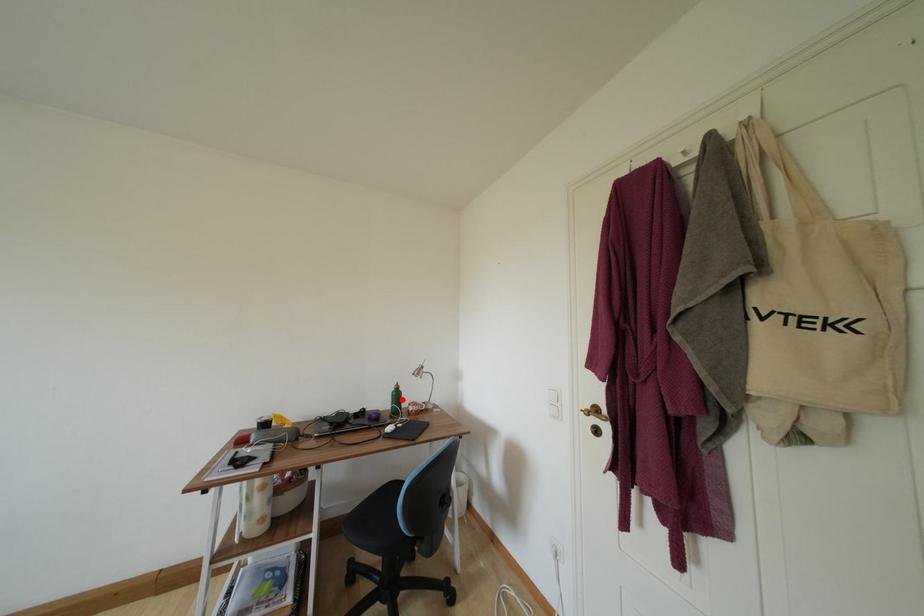
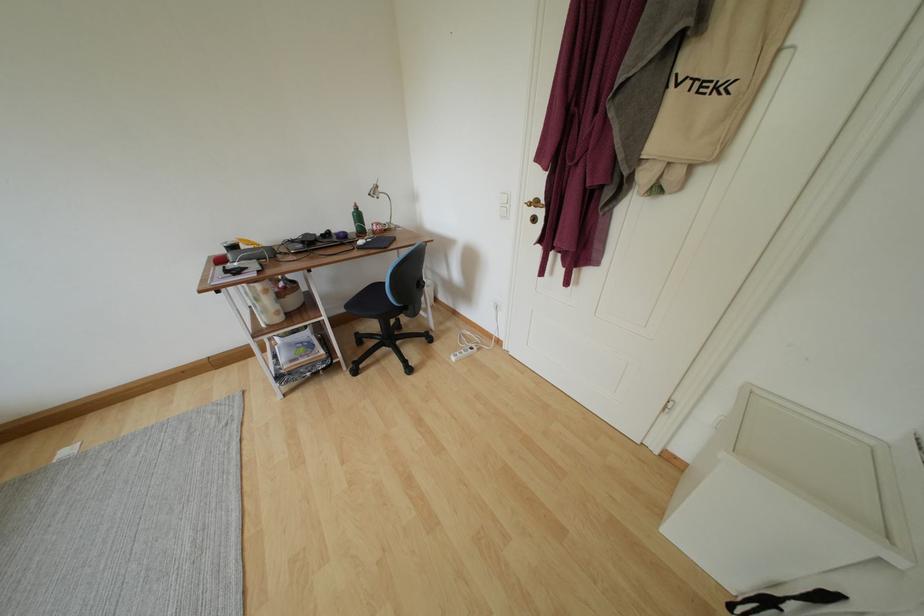
Question: I am providing you with two images of the same scene from different viewpoints. Image1 has a red point marked. In image2, the corresponding 3D location appears at what relative position? Reply with the corresponding letter.

Choices:
 (A) Closer
 (B) Farther

Answer: (A)